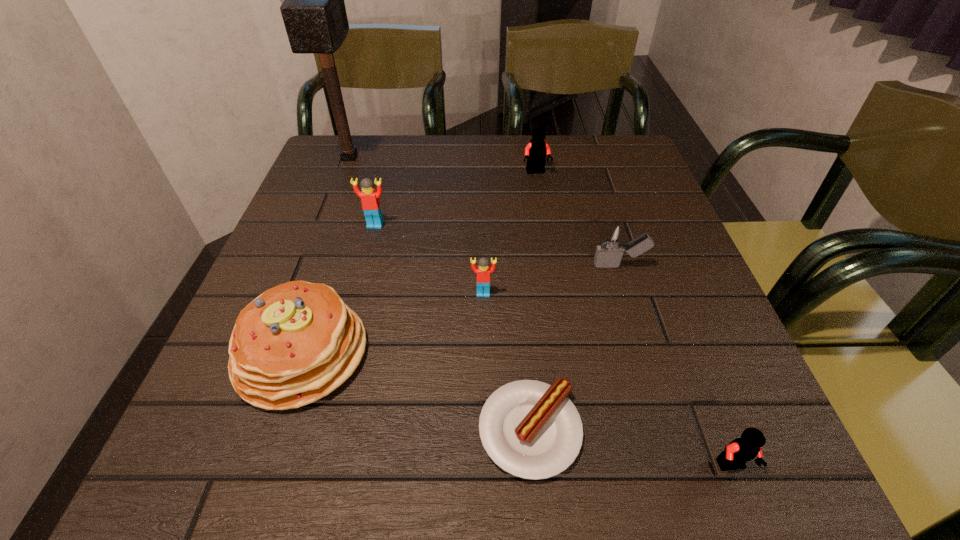
Where is `mallet positioned at the far edge`? The width and height of the screenshot is (960, 540). mallet positioned at the far edge is located at coordinates (314, 14).

This screenshot has height=540, width=960. I want to click on Lego located in the far edge section of the desktop, so click(x=536, y=151).

Where is `Lego at the near edge`? The height and width of the screenshot is (540, 960). Lego at the near edge is located at coordinates (740, 450).

Locate an element on the screen. sausage that is at the near edge is located at coordinates (530, 429).

This screenshot has height=540, width=960. I want to click on mallet located at the left edge, so click(x=314, y=14).

Where is `pancake located in the left edge section of the desktop`? pancake located in the left edge section of the desktop is located at coordinates (297, 342).

Find the location of a particular element. The height and width of the screenshot is (540, 960). igniter present at the right edge is located at coordinates (613, 238).

Locate an element on the screen. Lego positioned at the right edge is located at coordinates (740, 450).

What are the coordinates of `object present at the far left corner` in the screenshot? It's located at (314, 14).

You are a GUI agent. You are given a task and a screenshot of the screen. Output one action in this format:
    pyautogui.click(x=<x>, y=<y>)
    Task: Click on the object that is at the near right corner
    The height and width of the screenshot is (540, 960).
    Given the screenshot: What is the action you would take?
    pyautogui.click(x=740, y=450)